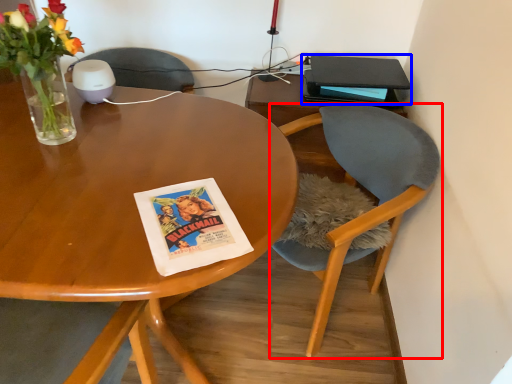
Question: Among these objects, which one is nearest to the camera, chair (highlighted by a red box) or paperback book (highlighted by a blue box)?

Choices:
 (A) chair
 (B) paperback book

Answer: (A)